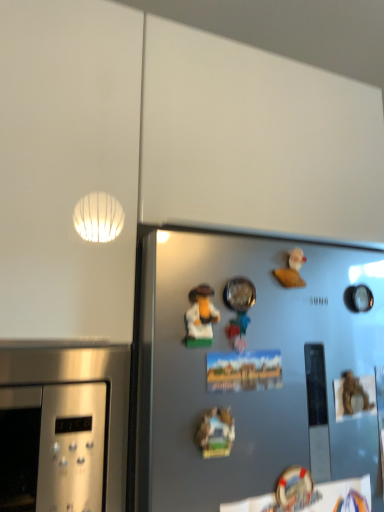
Question: Does wooden miniature house at center, which is the 2th art from top to bottom, have a greater width compared to matte plastic toy at center, marked as the first art in a top-to-bottom arrangement?

Choices:
 (A) no
 (B) yes

Answer: (A)

Question: Does wooden miniature house at center, which is the 2th art from top to bottom, have a smaller size compared to matte plastic toy at center, marked as the first art in a top-to-bottom arrangement?

Choices:
 (A) no
 (B) yes

Answer: (B)

Question: From a real-world perspective, is wooden miniature house at center, the 1th art ordered from the bottom, physically above matte plastic toy at center, which appears as the second art when ordered from the bottom?

Choices:
 (A) yes
 (B) no

Answer: (B)

Question: From a real-world perspective, is wooden miniature house at center, the 1th art ordered from the bottom, physically below matte plastic toy at center, marked as the first art in a top-to-bottom arrangement?

Choices:
 (A) yes
 (B) no

Answer: (A)

Question: Can you confirm if wooden miniature house at center, which is the 2th art from top to bottom, is taller than matte plastic toy at center, which appears as the second art when ordered from the bottom?

Choices:
 (A) no
 (B) yes

Answer: (A)

Question: Does point (254, 294) appear closer or farther from the camera than point (203, 436)?

Choices:
 (A) closer
 (B) farther

Answer: (B)

Question: Based on their sizes in the image, would you say metallic silver bowl at center, the 2th toy when ordered from back to front, is bigger or smaller than wooden miniature house at center, which is the 2th art from top to bottom?

Choices:
 (A) big
 (B) small

Answer: (A)

Question: From their relative heights in the image, would you say metallic silver bowl at center, the first toy when ordered from left to right, is taller or shorter than wooden miniature house at center, which is the 2th art from top to bottom?

Choices:
 (A) short
 (B) tall

Answer: (B)

Question: In terms of width, does metallic silver bowl at center, the first toy when ordered from left to right, look wider or thinner when compared to wooden miniature house at center, which is the 2th art from top to bottom?

Choices:
 (A) thin
 (B) wide

Answer: (A)

Question: In the image, is wooden miniature house at center, the 1th art ordered from the bottom, on the left side or the right side of white matte rubber duck at upper right, which appears as the 2th toy when viewed from the left?

Choices:
 (A) left
 (B) right

Answer: (A)

Question: Relative to white matte rubber duck at upper right, placed as the 2th toy when sorted from front to back, is wooden miniature house at center, the 1th art ordered from the bottom, in front or behind?

Choices:
 (A) front
 (B) behind

Answer: (A)

Question: In terms of width, does wooden miniature house at center, the 1th art ordered from the bottom, look wider or thinner when compared to white matte rubber duck at upper right, placed as the 2th toy when sorted from front to back?

Choices:
 (A) thin
 (B) wide

Answer: (B)

Question: Based on their sizes in the image, would you say wooden miniature house at center, which is the 2th art from top to bottom, is bigger or smaller than white matte rubber duck at upper right, which appears as the 2th toy when viewed from the left?

Choices:
 (A) small
 (B) big

Answer: (B)

Question: From the image's perspective, is matte plastic toy at center, which appears as the second art when ordered from the bottom, located above or below white matte rubber duck at upper right, the first toy viewed from the back?

Choices:
 (A) below
 (B) above

Answer: (A)

Question: Is matte plastic toy at center, which appears as the second art when ordered from the bottom, in front of or behind white matte rubber duck at upper right, which appears as the 2th toy when viewed from the left, in the image?

Choices:
 (A) behind
 (B) front

Answer: (B)